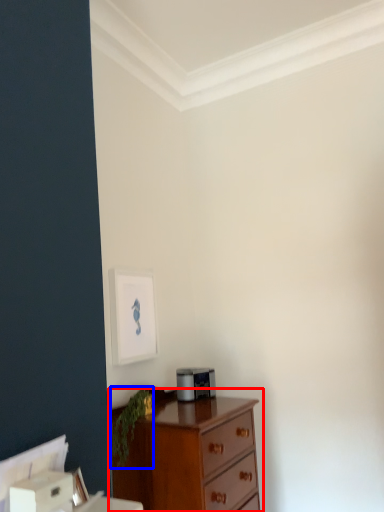
Question: Among these objects, which one is farthest to the camera, chest of drawers (highlighted by a red box) or plant (highlighted by a blue box)?

Choices:
 (A) chest of drawers
 (B) plant

Answer: (B)